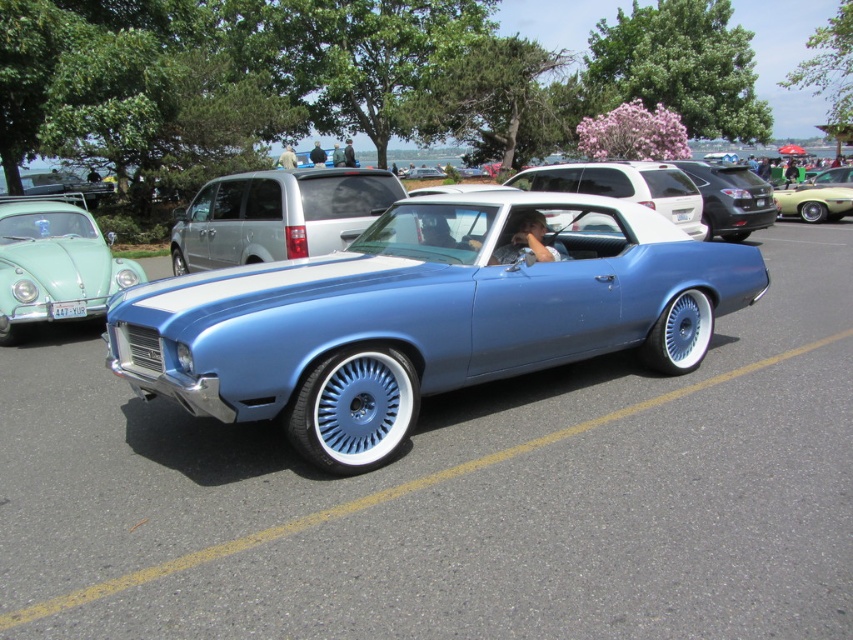
Between metallic blue convertible at center and satin black suv at center, which one appears on the right side from the viewer's perspective?

satin black suv at center

Between point (434, 260) and point (730, 225), which one is positioned in front?

Point (434, 260)

Who is more distant from viewer, [440,276] or [733,236]?

Positioned behind is point [733,236].

Find the location of a particular element. This screenshot has width=853, height=640. metallic blue convertible at center is located at coordinates (426, 316).

Is point (704, 282) more distant than point (816, 214)?

That is False.

Describe the element at coordinates (426, 316) in the screenshot. I see `metallic blue convertible at center` at that location.

Who is more forward, (x=108, y=321) or (x=828, y=196)?

Positioned in front is point (x=108, y=321).

Identify the location of metallic blue convertible at center. This screenshot has width=853, height=640. (426, 316).

Is point (628, 163) closer to viewer compared to point (717, 200)?

Yes, point (628, 163) is in front of point (717, 200).

Is point (579, 168) farther from camera compared to point (723, 225)?

That is False.

I want to click on metallic blue car at center, so click(x=624, y=186).